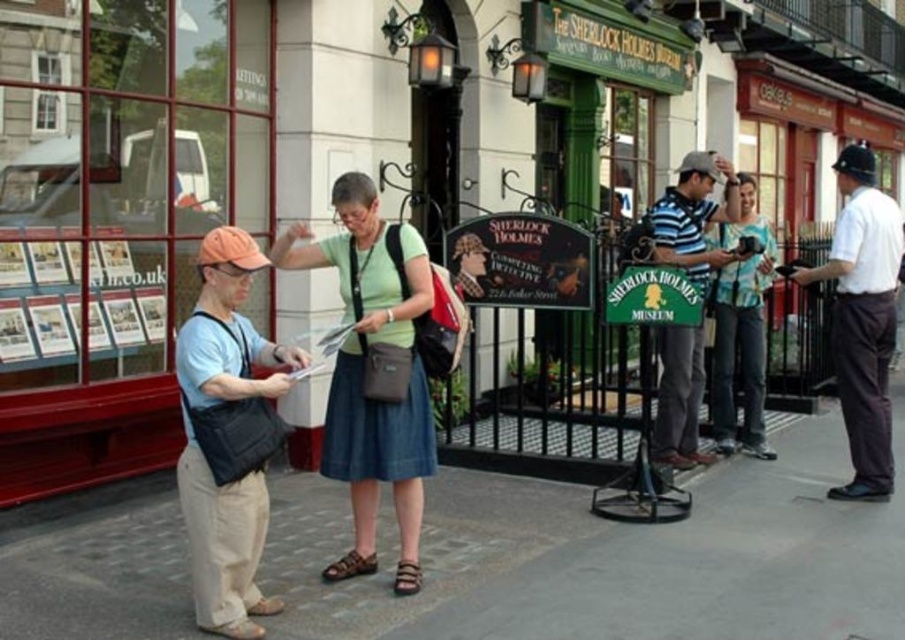
Who is higher up, green fabric skirt at center or matte black bag at left?

Positioned higher is green fabric skirt at center.

Who is lower down, green fabric skirt at center or matte black bag at left?

matte black bag at left is below.

What do you see at coordinates (368, 372) in the screenshot?
I see `green fabric skirt at center` at bounding box center [368, 372].

This screenshot has width=905, height=640. In order to click on green fabric skirt at center in this screenshot , I will do `click(368, 372)`.

Can you confirm if green fabric skirt at center is positioned to the left of teal jersey at center?

Correct, you'll find green fabric skirt at center to the left of teal jersey at center.

Can you confirm if green fabric skirt at center is wider than teal jersey at center?

Yes.

At what (x,y) coordinates should I click in order to perform the action: click on green fabric skirt at center. Please return your answer as a coordinate pair (x, y). This screenshot has width=905, height=640. Looking at the image, I should click on (368, 372).

Can you confirm if white cotton shirt at right is positioned to the left of striped polo shirt at center?

Incorrect, white cotton shirt at right is not on the left side of striped polo shirt at center.

Does white cotton shirt at right lie behind striped polo shirt at center?

Yes.

Between point (872, 492) and point (662, 387), which one is positioned behind?

The point (662, 387) is behind.

Locate an element on the screen. white cotton shirt at right is located at coordinates (862, 317).